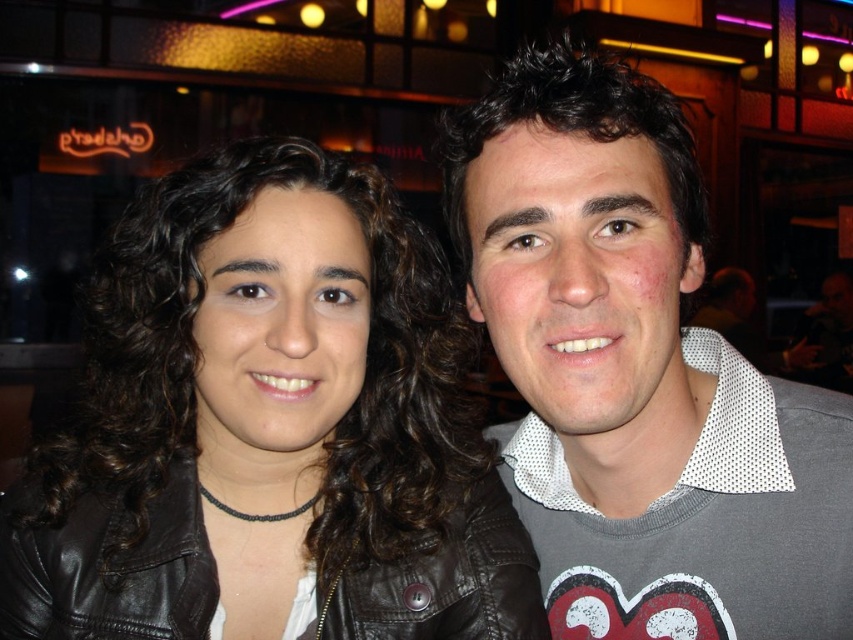
Question: Which point appears closest to the camera in this image?

Choices:
 (A) (453, 630)
 (B) (473, 451)

Answer: (A)

Question: Can you confirm if black leather jacket at upper left is thinner than gray mesh shirt at center?

Choices:
 (A) no
 (B) yes

Answer: (A)

Question: Which of the following is the closest to the observer?

Choices:
 (A) (218, 596)
 (B) (212, 342)
 (C) (637, 189)

Answer: (C)

Question: Can you confirm if gray mesh shirt at center is bigger than black leather jacket at center?

Choices:
 (A) no
 (B) yes

Answer: (B)

Question: Is gray mesh shirt at center to the right of black leather jacket at center from the viewer's perspective?

Choices:
 (A) no
 (B) yes

Answer: (B)

Question: Considering the real-world distances, which object is closest to the gray mesh shirt at center?

Choices:
 (A) black leather jacket at center
 (B) black leather jacket at upper left

Answer: (B)